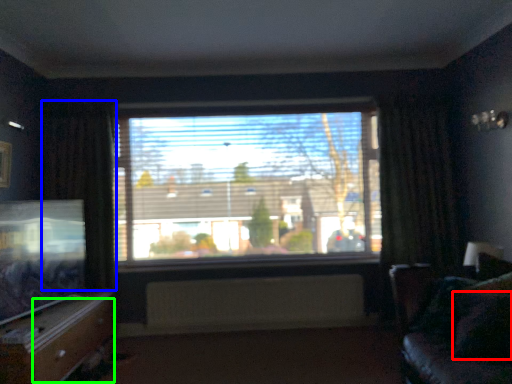
Question: Which object is positioned closest to pillow (highlighted by a red box)? Select from curtain (highlighted by a blue box) and drawer (highlighted by a green box).

Choices:
 (A) curtain
 (B) drawer

Answer: (B)